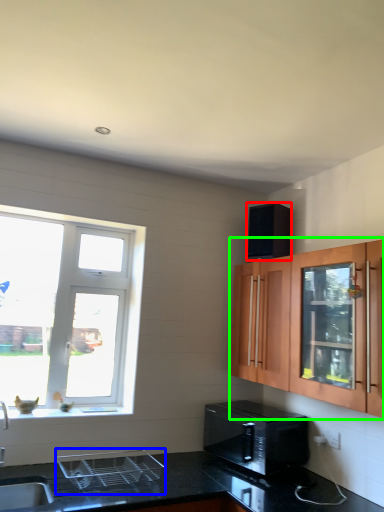
Question: Which is nearer to the appliance (highlighted by a red box)? appliance (highlighted by a blue box) or cabinetry (highlighted by a green box).

Choices:
 (A) appliance
 (B) cabinetry

Answer: (B)